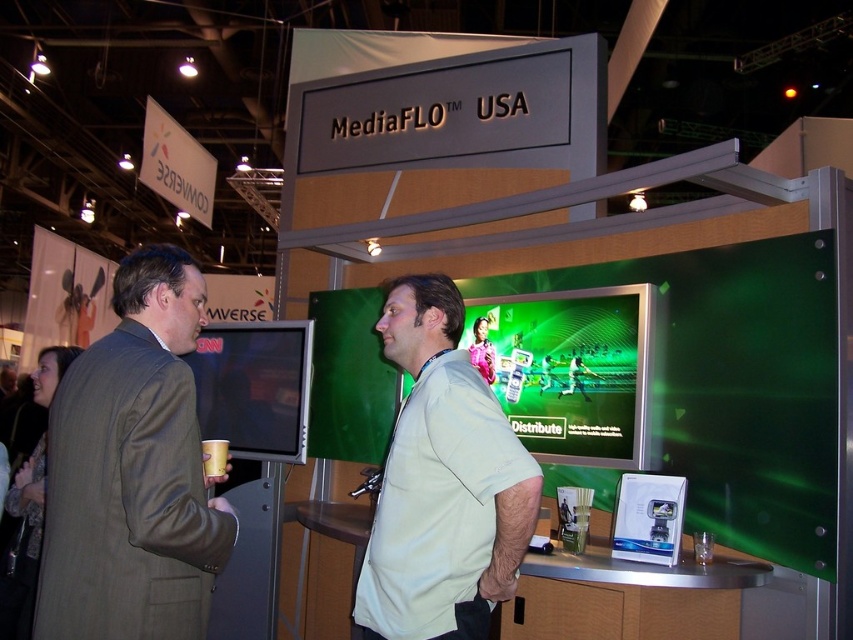
Question: Can you confirm if matte brown suit at left is wider than matte black monitor at center?

Choices:
 (A) yes
 (B) no

Answer: (B)

Question: Where is green glossy screen at center located in relation to matte black monitor at center in the image?

Choices:
 (A) below
 (B) above

Answer: (B)

Question: Estimate the real-world distances between objects in this image. Which object is farther from the matte black monitor at center?

Choices:
 (A) light beige shirt at center
 (B) green glossy screen at center
 (C) matte brown suit at left

Answer: (A)

Question: Which object appears farthest from the camera in this image?

Choices:
 (A) light beige shirt at center
 (B) matte brown suit at left

Answer: (A)

Question: Among these objects, which one is farthest from the camera?

Choices:
 (A) green glossy screen at center
 (B) matte brown suit at left
 (C) light beige shirt at center
 (D) matte black monitor at center

Answer: (D)

Question: Can you confirm if light beige shirt at center is positioned to the right of matte black monitor at center?

Choices:
 (A) yes
 (B) no

Answer: (A)